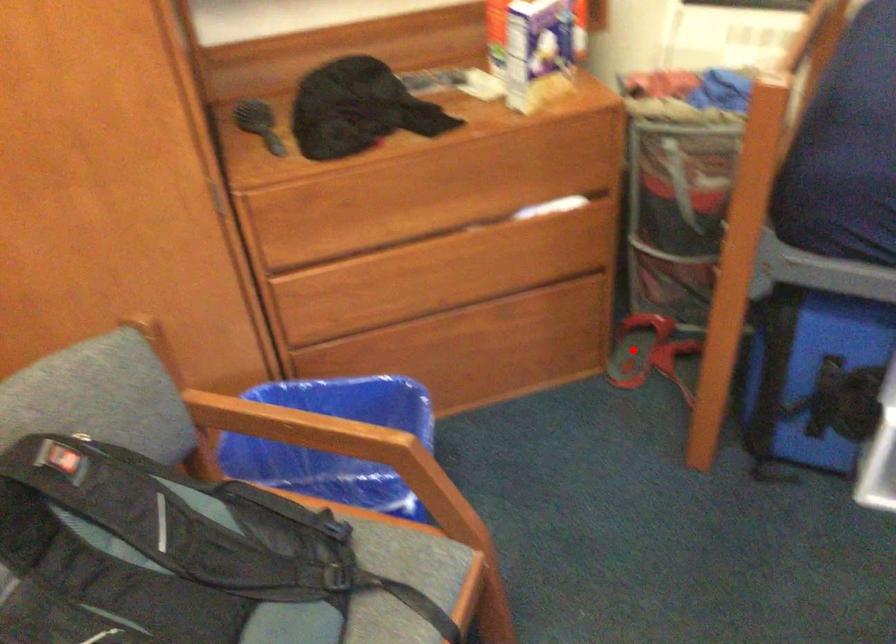
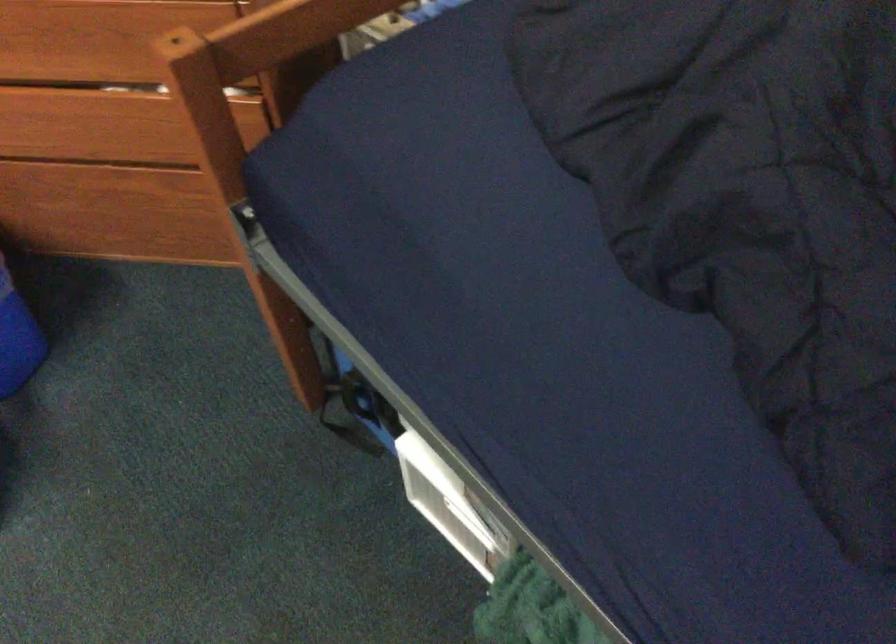
Question: I am providing you with two images of the same scene from different viewpoints. A red point is marked on the first image. Can you still see the location of the red point in image 2?

Choices:
 (A) Yes
 (B) No

Answer: (B)